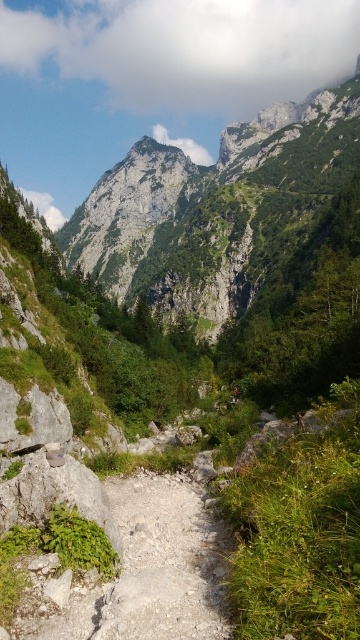
Question: Is rugged stone mountain at upper center wider than dusty gravel path at center?

Choices:
 (A) yes
 (B) no

Answer: (A)

Question: Which object is positioned closest to the rugged stone mountain at upper center?

Choices:
 (A) red fabric mountain biker at center
 (B) dusty gravel path at center

Answer: (A)

Question: Is rugged stone mountain at upper center wider than red fabric mountain biker at center?

Choices:
 (A) no
 (B) yes

Answer: (B)

Question: Based on their relative distances, which object is nearer to the dusty gravel path at center?

Choices:
 (A) red fabric mountain biker at center
 (B) rugged stone mountain at upper center

Answer: (A)

Question: Which object appears farthest from the camera in this image?

Choices:
 (A) rugged stone mountain at upper center
 (B) dusty gravel path at center
 (C) red fabric mountain biker at center

Answer: (A)

Question: Observing the image, what is the correct spatial positioning of rugged stone mountain at upper center in reference to red fabric mountain biker at center?

Choices:
 (A) above
 (B) below

Answer: (A)